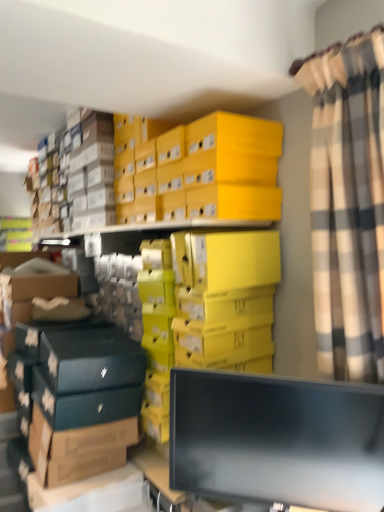
In order to face yellow cardboard box at upper center, should I rotate leftwards or rightwards?

To face it directly, rotate left by 1.123 degrees.

What do you see at coordinates (348, 204) in the screenshot?
I see `plaid fabric curtain at right` at bounding box center [348, 204].

In order to click on plaid fabric curtain at right in this screenshot , I will do `click(348, 204)`.

Where is `black glossy monitor at lower center`? This screenshot has width=384, height=512. black glossy monitor at lower center is located at coordinates (277, 440).

Which of these two, plaid fabric curtain at right or black glossy monitor at lower center, stands taller?

plaid fabric curtain at right is taller.

Does point (346, 194) appear closer or farther from the camera than point (343, 447)?

Point (346, 194) appears to be closer to the viewer than point (343, 447).

Locate an element on the screen. The width and height of the screenshot is (384, 512). curtain in front of the black glossy monitor at lower center is located at coordinates (348, 204).

Considering the relative sizes of plaid fabric curtain at right and black glossy monitor at lower center in the image provided, is plaid fabric curtain at right bigger than black glossy monitor at lower center?

Yes, plaid fabric curtain at right is bigger than black glossy monitor at lower center.

Is yellow cardboard box at upper center thinner than plaid fabric curtain at right?

No, yellow cardboard box at upper center is not thinner than plaid fabric curtain at right.

Locate an element on the screen. Image resolution: width=384 pixels, height=512 pixels. curtain below the yellow cardboard box at upper center (from the image's perspective) is located at coordinates click(x=348, y=204).

Considering the sizes of objects yellow cardboard box at upper center and plaid fabric curtain at right in the image provided, who is smaller, yellow cardboard box at upper center or plaid fabric curtain at right?

With smaller size is plaid fabric curtain at right.

Is black glossy monitor at lower center placed right next to plaid fabric curtain at right?

No, black glossy monitor at lower center is not next to plaid fabric curtain at right.

In the scene shown: Can you confirm if black glossy monitor at lower center is positioned to the left of plaid fabric curtain at right?

Correct, you'll find black glossy monitor at lower center to the left of plaid fabric curtain at right.

Which of these two, black glossy monitor at lower center or plaid fabric curtain at right, is bigger?

plaid fabric curtain at right.

I want to click on curtain that appears above the black glossy monitor at lower center (from a real-world perspective), so click(348, 204).

The height and width of the screenshot is (512, 384). I want to click on computer monitor below the yellow cardboard box at upper center (from the image's perspective), so click(x=277, y=440).

Is yellow cardboard box at upper center inside or outside of black glossy monitor at lower center?

yellow cardboard box at upper center lies outside black glossy monitor at lower center.

Is yellow cardboard box at upper center further to camera compared to black glossy monitor at lower center?

Yes, it is.

In the scene shown: How many degrees apart are the facing directions of plaid fabric curtain at right and yellow cardboard box at upper center?

The facing directions of plaid fabric curtain at right and yellow cardboard box at upper center are 5.69 degrees apart.

Is plaid fabric curtain at right wider or thinner than yellow cardboard box at upper center?

Considering their sizes, plaid fabric curtain at right looks slimmer than yellow cardboard box at upper center.

From a real-world perspective, does plaid fabric curtain at right stand above yellow cardboard box at upper center?

Actually, plaid fabric curtain at right is physically below yellow cardboard box at upper center in the real world.

Which is in front, plaid fabric curtain at right or yellow cardboard box at upper center?

plaid fabric curtain at right is more forward.

Does black glossy monitor at lower center lie behind yellow cardboard box at upper center?

That is False.

Considering the relative sizes of black glossy monitor at lower center and yellow cardboard box at upper center in the image provided, is black glossy monitor at lower center thinner than yellow cardboard box at upper center?

Yes.

Is black glossy monitor at lower center located outside yellow cardboard box at upper center?

Yes, black glossy monitor at lower center is not within yellow cardboard box at upper center.

This screenshot has width=384, height=512. In order to click on curtain in front of the black glossy monitor at lower center in this screenshot , I will do `click(348, 204)`.

You are a GUI agent. You are given a task and a screenshot of the screen. Output one action in this format:
    pyautogui.click(x=<x>, y=<y>)
    Task: Click on the storage box on the left side of plaid fabric curtain at right
    The width and height of the screenshot is (384, 512).
    Given the screenshot: What is the action you would take?
    pyautogui.click(x=202, y=172)

Considering their positions, is plaid fabric curtain at right positioned closer to yellow cardboard box at upper center than black glossy monitor at lower center?

plaid fabric curtain at right lies closer to yellow cardboard box at upper center than the other object.

Based on the photo, looking at the image, which one is located closer to black glossy monitor at lower center, plaid fabric curtain at right or yellow cardboard box at upper center?

plaid fabric curtain at right.

Looking at the image, which one is located closer to plaid fabric curtain at right, black glossy monitor at lower center or yellow cardboard box at upper center?

black glossy monitor at lower center is positioned closer to the anchor plaid fabric curtain at right.

Looking at the image, which one is located further to yellow cardboard box at upper center, black glossy monitor at lower center or plaid fabric curtain at right?

black glossy monitor at lower center is further to yellow cardboard box at upper center.

When comparing their distances from plaid fabric curtain at right, does yellow cardboard box at upper center or black glossy monitor at lower center seem closer?

The object closer to plaid fabric curtain at right is black glossy monitor at lower center.

Based on their spatial positions, is yellow cardboard box at upper center or plaid fabric curtain at right closer to black glossy monitor at lower center?

Among the two, plaid fabric curtain at right is located nearer to black glossy monitor at lower center.

Where is `curtain between yellow cardboard box at upper center and black glossy monitor at lower center vertically`? The width and height of the screenshot is (384, 512). curtain between yellow cardboard box at upper center and black glossy monitor at lower center vertically is located at coordinates (348, 204).